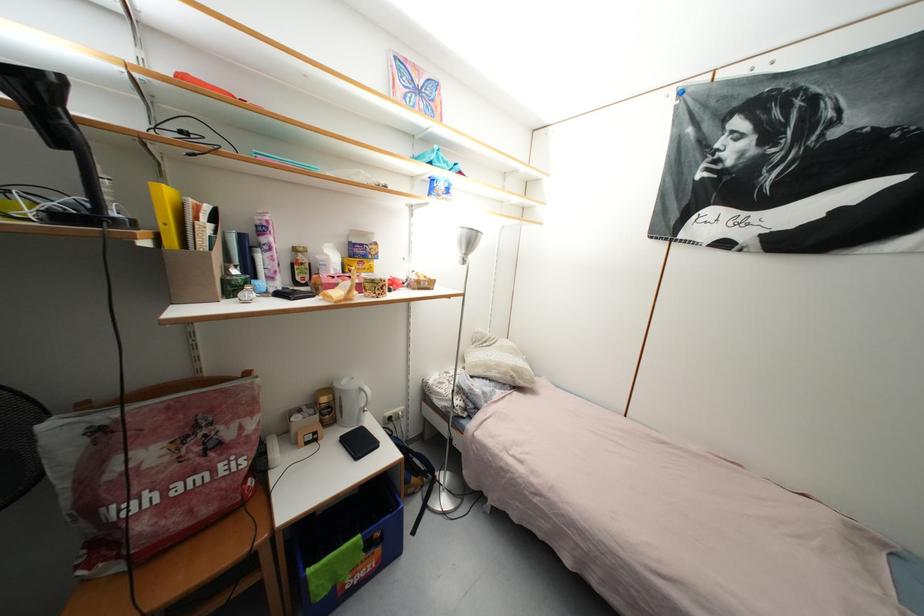
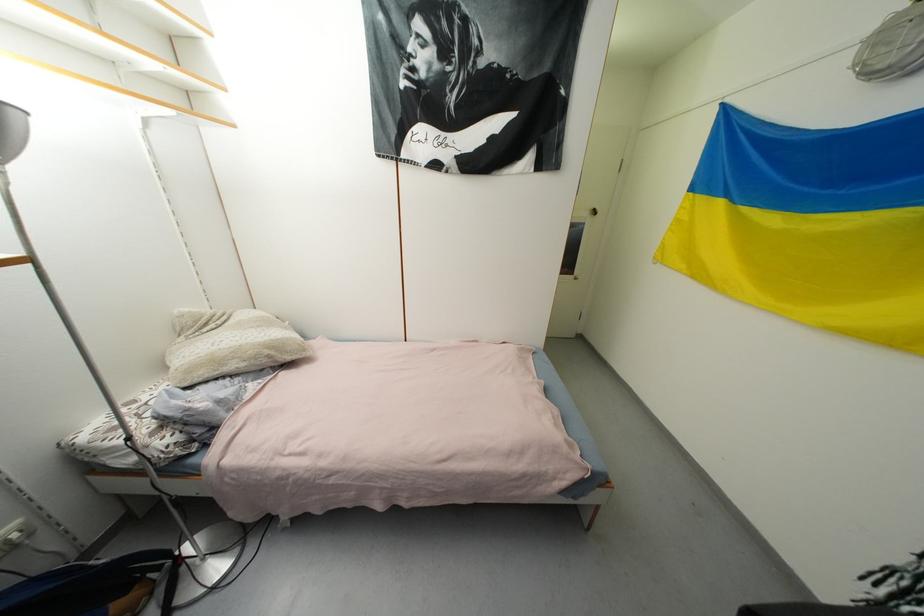
The point at (511, 376) is marked in the first image. Where is the corresponding point in the second image?

(261, 359)